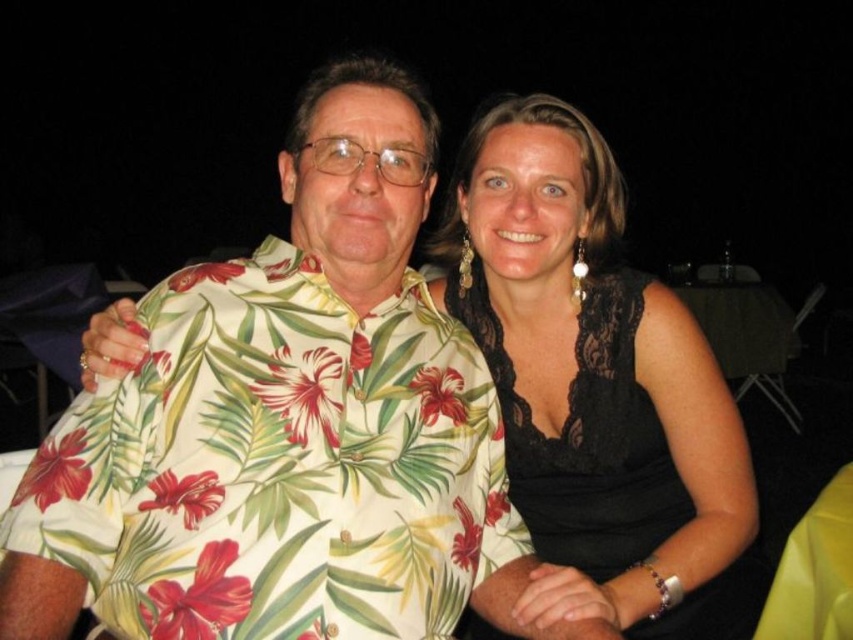
In the scene shown: Between floral print fabric shirt at center and black lace dress at center, which one appears on the left side from the viewer's perspective?

From the viewer's perspective, floral print fabric shirt at center appears more on the left side.

Between floral print fabric shirt at center and black lace dress at center, which one is positioned higher?

black lace dress at center

You are a GUI agent. You are given a task and a screenshot of the screen. Output one action in this format:
    pyautogui.click(x=<x>, y=<y>)
    Task: Click on the floral print fabric shirt at center
    This screenshot has height=640, width=853.
    Given the screenshot: What is the action you would take?
    pyautogui.click(x=277, y=465)

The image size is (853, 640). What are the coordinates of `floral print fabric shirt at center` in the screenshot? It's located at (277, 465).